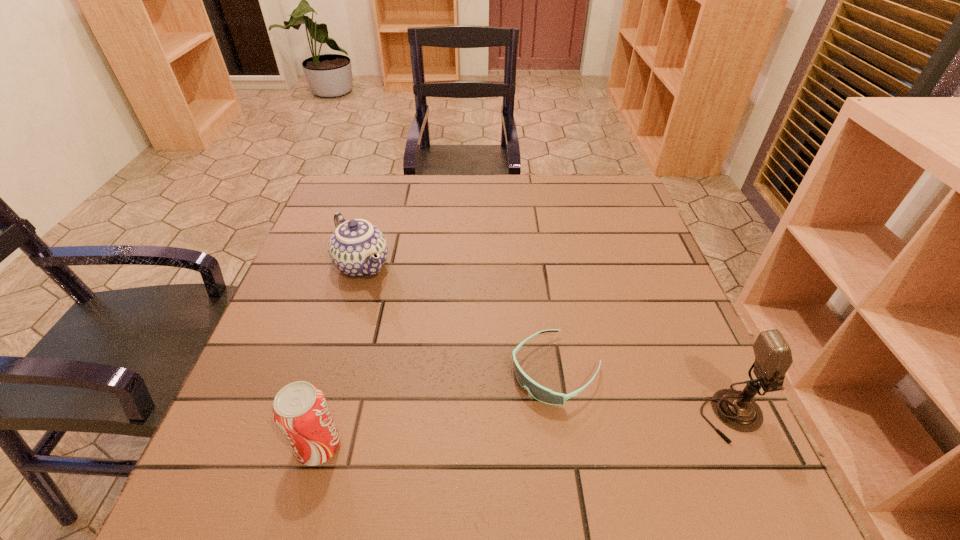
Where is `free space located 0.050m on the front-facing side of the third object from left to right`? The height and width of the screenshot is (540, 960). free space located 0.050m on the front-facing side of the third object from left to right is located at coordinates click(x=506, y=412).

Identify the location of vacant space situated 0.060m on the front-facing side of the third object from left to right. This screenshot has height=540, width=960. (501, 415).

Where is `free region located 0.100m on the front-facing side of the third object from left to right`? The width and height of the screenshot is (960, 540). free region located 0.100m on the front-facing side of the third object from left to right is located at coordinates (485, 429).

Identify the location of soda can that is at the near edge. Image resolution: width=960 pixels, height=540 pixels. (300, 411).

Locate an element on the screen. microphone that is at the near edge is located at coordinates [x=773, y=357].

At what (x,y) coordinates should I click in order to perform the action: click on goggles that is positioned at the near edge. Please return your answer as a coordinate pair (x, y). This screenshot has height=540, width=960. Looking at the image, I should click on (538, 392).

Identify the location of soda can that is at the left edge. Image resolution: width=960 pixels, height=540 pixels. (300, 411).

This screenshot has width=960, height=540. I want to click on chinaware located at the left edge, so click(x=357, y=248).

Where is `object that is at the right edge`? object that is at the right edge is located at coordinates (773, 357).

The image size is (960, 540). In order to click on object at the near left corner in this screenshot , I will do `click(300, 411)`.